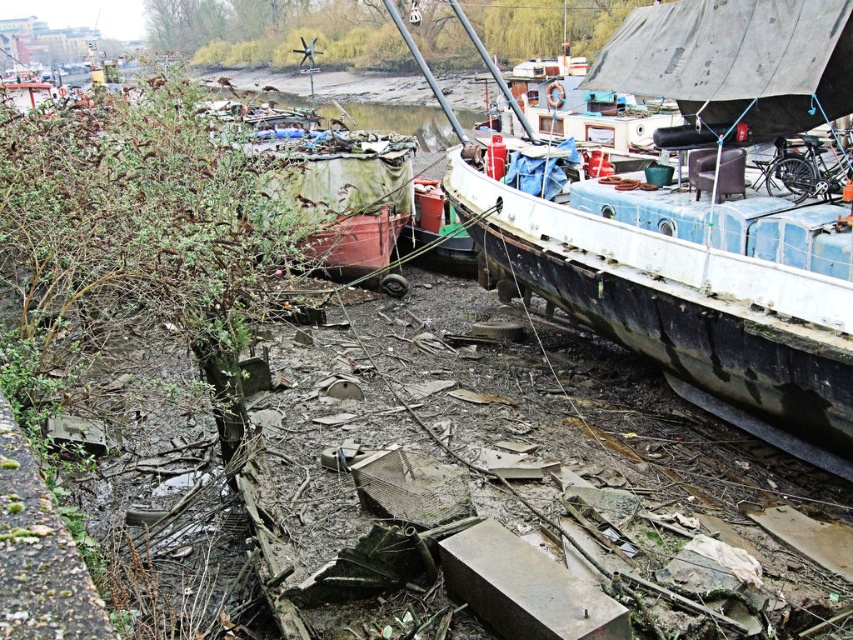
You are an inspector checking the dockyard. You notice the blue painted wood boat at right and the rusty metal boat at center. Which boat is lower in height?

The blue painted wood boat at right has a lesser height compared to the rusty metal boat at center, so the blue painted wood boat at right is lower in height.

You are standing at the origin point of the coordinate system in the dockyard. The blue painted wood boat at right is located at coordinates 0.348, 0.830. If you want to reach the boat, which direction should you move in?

The blue painted wood boat at right is located at coordinates (706,217). To reach it, you should move towards the right and slightly forward from your current position at the origin.

You are a dock inspector checking the condition of the boats. You need to determine which boat is wider. Which one is wider between the blue painted wood boat at right and the rusty metal boat at center?

The rusty metal boat at center is wider than the blue painted wood boat at right.